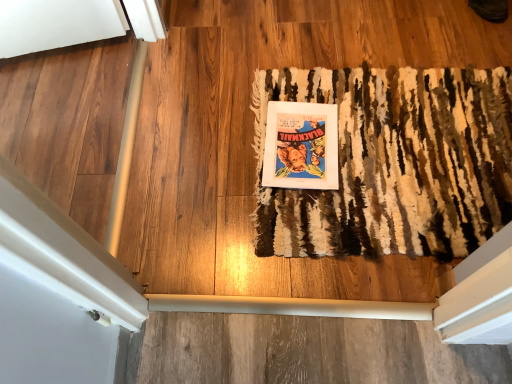
Find the location of `free space above rug at center (from a real-world perspective)`. free space above rug at center (from a real-world perspective) is located at coordinates (374, 149).